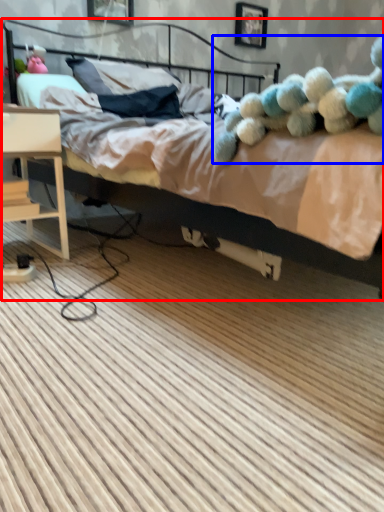
Question: Which point is further to the camera, bed (highlighted by a red box) or teddy (highlighted by a blue box)?

Choices:
 (A) bed
 (B) teddy

Answer: (B)